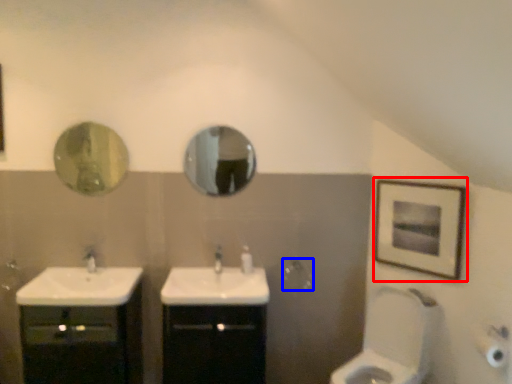
Question: Which object is closer to the camera taking this photo, picture frame (highlighted by a red box) or towel bar (highlighted by a blue box)?

Choices:
 (A) picture frame
 (B) towel bar

Answer: (A)